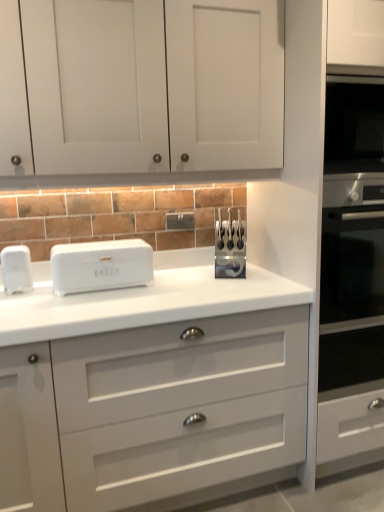
Question: From the image's perspective, is white plastic electric outlet at center under white plastic bread bin at left, which appears as the first home appliance when viewed from the left?

Choices:
 (A) yes
 (B) no

Answer: (B)

Question: Is white plastic electric outlet at center next to white plastic bread bin at left, which appears as the first home appliance when viewed from the left?

Choices:
 (A) yes
 (B) no

Answer: (B)

Question: Is white plastic bread bin at left, which appears as the first home appliance when viewed from the left, a part of white plastic electric outlet at center?

Choices:
 (A) yes
 (B) no

Answer: (B)

Question: Is white plastic electric outlet at center positioned beyond the bounds of white plastic bread bin at left, arranged as the 2th home appliance when viewed from the right?

Choices:
 (A) no
 (B) yes

Answer: (B)

Question: Considering the relative sizes of white plastic electric outlet at center and white plastic bread bin at left, which appears as the first home appliance when viewed from the left, in the image provided, is white plastic electric outlet at center thinner than white plastic bread bin at left, which appears as the first home appliance when viewed from the left,?

Choices:
 (A) no
 (B) yes

Answer: (B)

Question: Considering the relative positions of white plastic electric outlet at center and white plastic bread bin at left, arranged as the 2th home appliance when viewed from the right, in the image provided, is white plastic electric outlet at center to the right of white plastic bread bin at left, arranged as the 2th home appliance when viewed from the right, from the viewer's perspective?

Choices:
 (A) no
 (B) yes

Answer: (B)

Question: From the image's perspective, is white plastic bread bin at left, arranged as the 2th home appliance when viewed from the right, under white matte cabinet doors at upper center?

Choices:
 (A) yes
 (B) no

Answer: (A)

Question: Would you consider white plastic bread bin at left, which appears as the first home appliance when viewed from the left, to be distant from white matte cabinet doors at upper center?

Choices:
 (A) no
 (B) yes

Answer: (A)

Question: Does white plastic bread bin at left, which appears as the first home appliance when viewed from the left, come in front of white matte cabinet doors at upper center?

Choices:
 (A) no
 (B) yes

Answer: (A)

Question: Can you confirm if white plastic bread bin at left, which appears as the first home appliance when viewed from the left, is thinner than white matte cabinet doors at upper center?

Choices:
 (A) no
 (B) yes

Answer: (B)

Question: Considering the relative sizes of white plastic bread bin at left, which appears as the first home appliance when viewed from the left, and white matte cabinet doors at upper center in the image provided, is white plastic bread bin at left, which appears as the first home appliance when viewed from the left, taller than white matte cabinet doors at upper center?

Choices:
 (A) yes
 (B) no

Answer: (B)

Question: Considering the relative sizes of white plastic bread bin at left, arranged as the 2th home appliance when viewed from the right, and white matte cabinet doors at upper center in the image provided, is white plastic bread bin at left, arranged as the 2th home appliance when viewed from the right, bigger than white matte cabinet doors at upper center?

Choices:
 (A) no
 (B) yes

Answer: (A)

Question: Is white glossy chest of drawers at center positioned in front of white glossy bread bin at center, placed as the second home appliance when sorted from left to right?

Choices:
 (A) yes
 (B) no

Answer: (A)